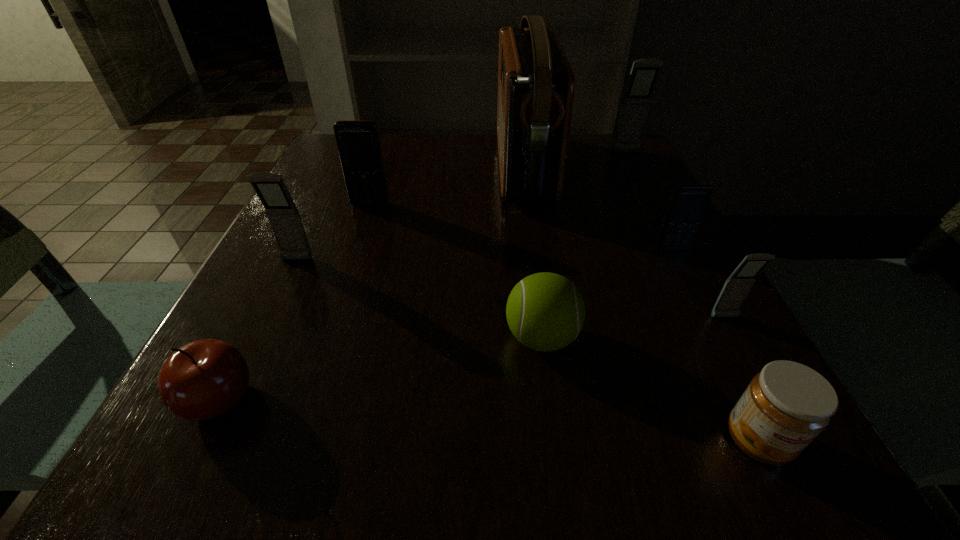
At what (x,y) coordinates should I click in order to perform the action: click on unoccupied position between the apple and the leftmost cellular telephone. Please return your answer as a coordinate pair (x, y). The height and width of the screenshot is (540, 960). Looking at the image, I should click on (258, 330).

The image size is (960, 540). Find the location of `unoccupied position between the radio receiver and the orange jam`. unoccupied position between the radio receiver and the orange jam is located at coordinates (640, 304).

Find the location of `blank region between the second farthest gray cellular telephone and the second tallest object`. blank region between the second farthest gray cellular telephone and the second tallest object is located at coordinates (462, 207).

The width and height of the screenshot is (960, 540). Find the location of `free space between the left orange cellular telephone and the fifth farthest object`. free space between the left orange cellular telephone and the fifth farthest object is located at coordinates (333, 232).

Where is `vacant area that lies between the leftmost gray cellular telephone and the left orange cellular telephone`? vacant area that lies between the leftmost gray cellular telephone and the left orange cellular telephone is located at coordinates (333, 232).

This screenshot has height=540, width=960. In order to click on vacant area that lies between the farther orange cellular telephone and the tennis ball in this screenshot , I will do `click(456, 271)`.

At what (x,y) coordinates should I click in order to perform the action: click on empty location between the farthest cellular telephone and the nearer orange cellular telephone. Please return your answer as a coordinate pair (x, y). This screenshot has height=540, width=960. Looking at the image, I should click on (649, 201).

The image size is (960, 540). Find the location of `free space between the orange jam and the third nearest cellular telephone`. free space between the orange jam and the third nearest cellular telephone is located at coordinates (715, 345).

This screenshot has height=540, width=960. Identify the location of object that stands as the second closest to the apple. (545, 311).

Choose which object is the seventh nearest neighbor to the green tennis ball. Please provide its 2D coordinates. Your answer should be formatted as a tuple, i.e. [(x, y)], where the tuple contains the x and y coordinates of a point satisfying the conditions above.

[(358, 142)]